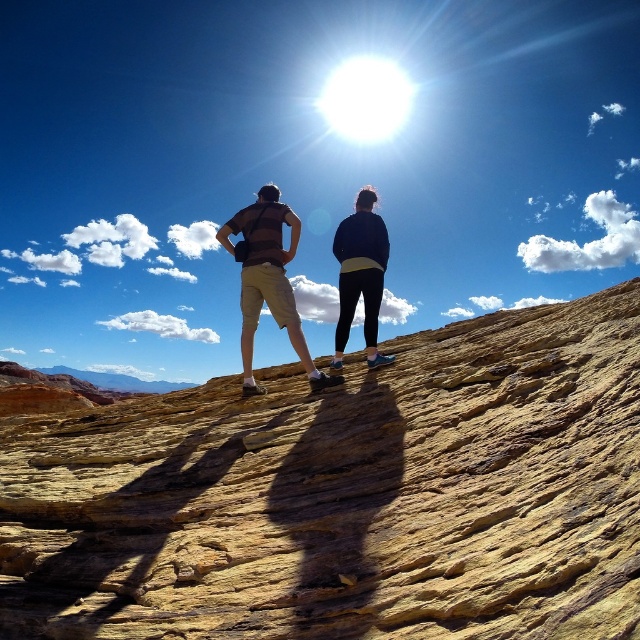
Question: Which of the following is the farthest from the observer?

Choices:
 (A) (380, 259)
 (B) (291, 244)
 (C) (492, 560)

Answer: (B)

Question: Considering the relative positions of matte beige shorts at center and dark blue fleece jacket at center in the image provided, where is matte beige shorts at center located with respect to dark blue fleece jacket at center?

Choices:
 (A) below
 (B) above

Answer: (A)

Question: Which point is farther from the camera taking this photo?

Choices:
 (A) (248, 304)
 (B) (356, 465)
 (C) (337, 252)

Answer: (C)

Question: Can you confirm if yellow sandstone at center is positioned above matte beige shorts at center?

Choices:
 (A) no
 (B) yes

Answer: (A)

Question: Is yellow sandstone at center further to the viewer compared to dark blue fleece jacket at center?

Choices:
 (A) yes
 (B) no

Answer: (B)

Question: Among these objects, which one is farthest from the camera?

Choices:
 (A) dark blue fleece jacket at center
 (B) matte beige shorts at center
 (C) yellow sandstone at center

Answer: (A)